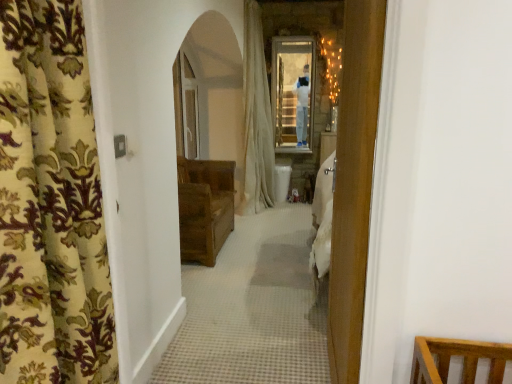
Question: Is floral fabric curtain at left, marked as the first curtain in a left-to-right arrangement, placed right next to white fabric curtain at center, the first curtain from the back?

Choices:
 (A) yes
 (B) no

Answer: (B)

Question: Considering the relative sizes of floral fabric curtain at left, the second curtain in the right-to-left sequence, and white fabric curtain at center, acting as the 2th curtain starting from the front, in the image provided, is floral fabric curtain at left, the second curtain in the right-to-left sequence, shorter than white fabric curtain at center, acting as the 2th curtain starting from the front,?

Choices:
 (A) yes
 (B) no

Answer: (A)

Question: Is floral fabric curtain at left, the second curtain in the right-to-left sequence, positioned with its back to white fabric curtain at center, acting as the 2th curtain starting from the front?

Choices:
 (A) yes
 (B) no

Answer: (B)

Question: Does floral fabric curtain at left, the second curtain in the right-to-left sequence, appear on the left side of white fabric curtain at center, the first curtain from the back?

Choices:
 (A) yes
 (B) no

Answer: (A)

Question: Does floral fabric curtain at left, the second curtain in the right-to-left sequence, lie in front of white fabric curtain at center, acting as the 2th curtain starting from the front?

Choices:
 (A) no
 (B) yes

Answer: (B)

Question: Is floral fabric curtain at left, placed as the 1th curtain when sorted from front to back, bigger than white fabric curtain at center, arranged as the first curtain when viewed from the right?

Choices:
 (A) yes
 (B) no

Answer: (B)

Question: Does floral fabric curtain at left, placed as the 1th curtain when sorted from front to back, come behind brown wooden chest at center?

Choices:
 (A) yes
 (B) no

Answer: (B)

Question: Can you confirm if floral fabric curtain at left, placed as the 1th curtain when sorted from front to back, is wider than brown wooden chest at center?

Choices:
 (A) yes
 (B) no

Answer: (B)

Question: Can you confirm if floral fabric curtain at left, which is the second curtain in back-to-front order, is positioned to the right of brown wooden chest at center?

Choices:
 (A) yes
 (B) no

Answer: (A)

Question: From the image's perspective, is floral fabric curtain at left, which is the second curtain in back-to-front order, located beneath brown wooden chest at center?

Choices:
 (A) no
 (B) yes

Answer: (B)

Question: Does floral fabric curtain at left, marked as the first curtain in a left-to-right arrangement, turn towards brown wooden chest at center?

Choices:
 (A) no
 (B) yes

Answer: (A)

Question: Are floral fabric curtain at left, the second curtain in the right-to-left sequence, and brown wooden chest at center located far from each other?

Choices:
 (A) yes
 (B) no

Answer: (A)

Question: Is white fabric curtain at center, arranged as the first curtain when viewed from the right, next to brown wooden chest at center?

Choices:
 (A) yes
 (B) no

Answer: (B)